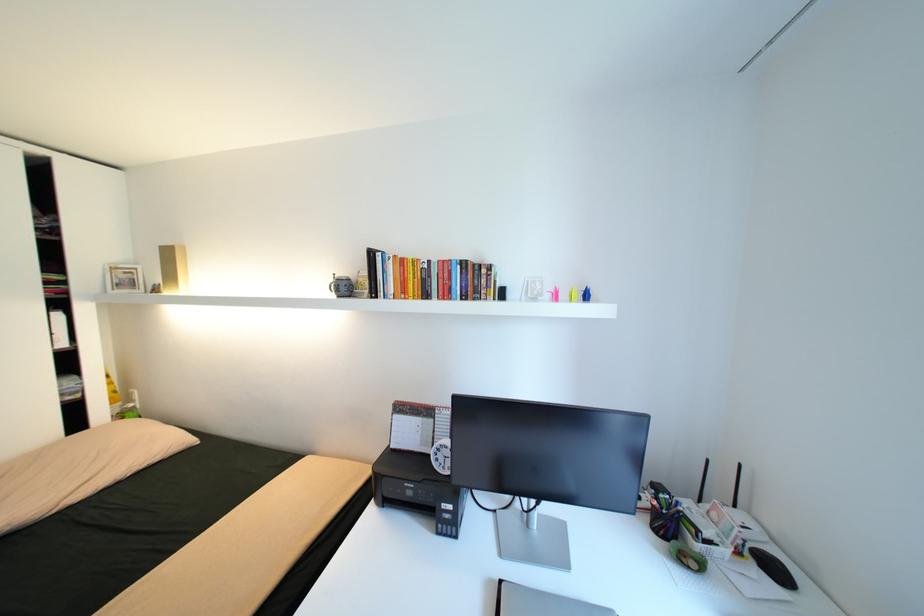
Where would you lift the colorful book? Please return your answer as a coordinate pair (x, y).

(431, 278)